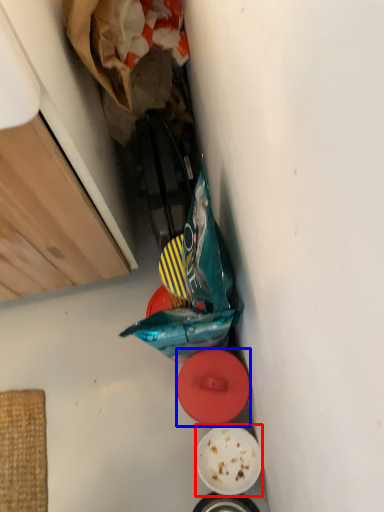
Question: Which point is closer to the camera, plate (highlighted by a red box) or plate (highlighted by a blue box)?

Choices:
 (A) plate
 (B) plate

Answer: (B)